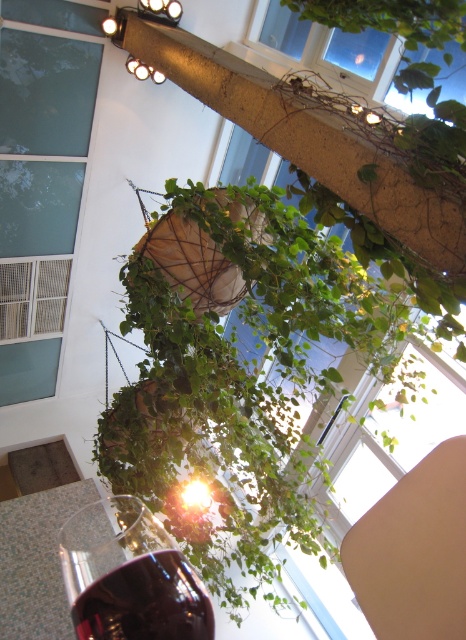
Question: Does green leafy plant at center have a smaller size compared to transparent glass at center?

Choices:
 (A) yes
 (B) no

Answer: (B)

Question: Which point is farther from the camera taking this photo?

Choices:
 (A) (191, 580)
 (B) (97, 445)

Answer: (B)

Question: Which object is closer to the camera taking this photo?

Choices:
 (A) green leafy plant at center
 (B) transparent glass at center

Answer: (B)

Question: Can you confirm if green leafy plant at center is positioned to the right of transparent glass at center?

Choices:
 (A) no
 (B) yes

Answer: (B)

Question: Is green leafy plant at center bigger than transparent glass at center?

Choices:
 (A) yes
 (B) no

Answer: (A)